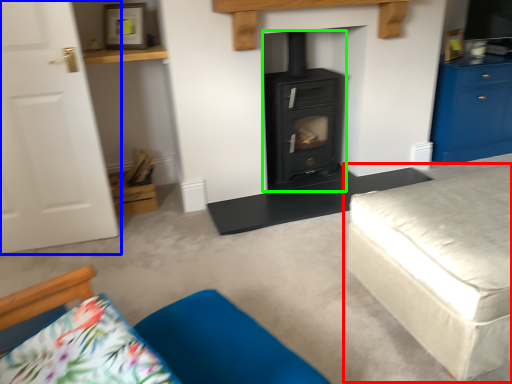
Question: Which object is the closest to the studio couch (highlighted by a red box)? Choose among these: door (highlighted by a blue box) or wood burning stove (highlighted by a green box).

Choices:
 (A) door
 (B) wood burning stove

Answer: (B)